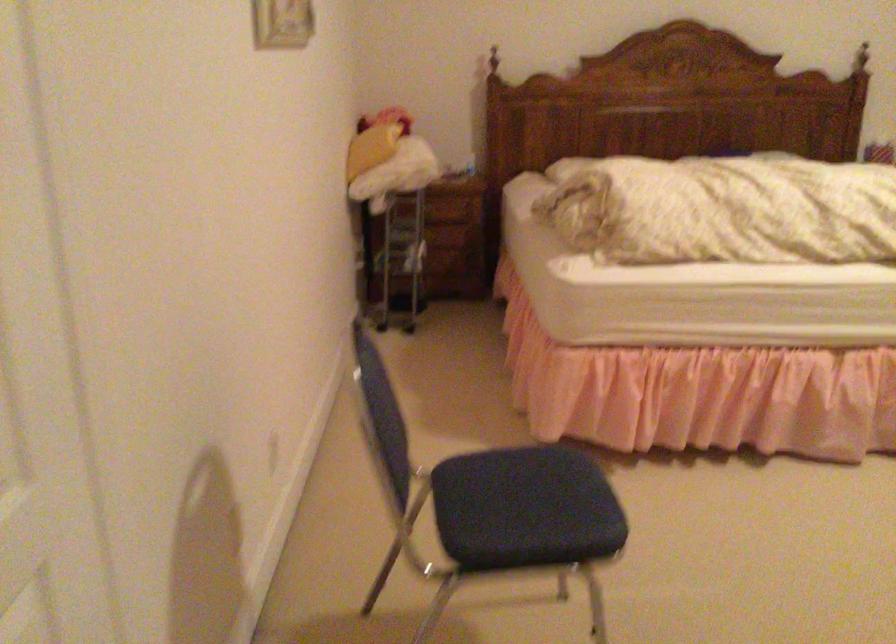
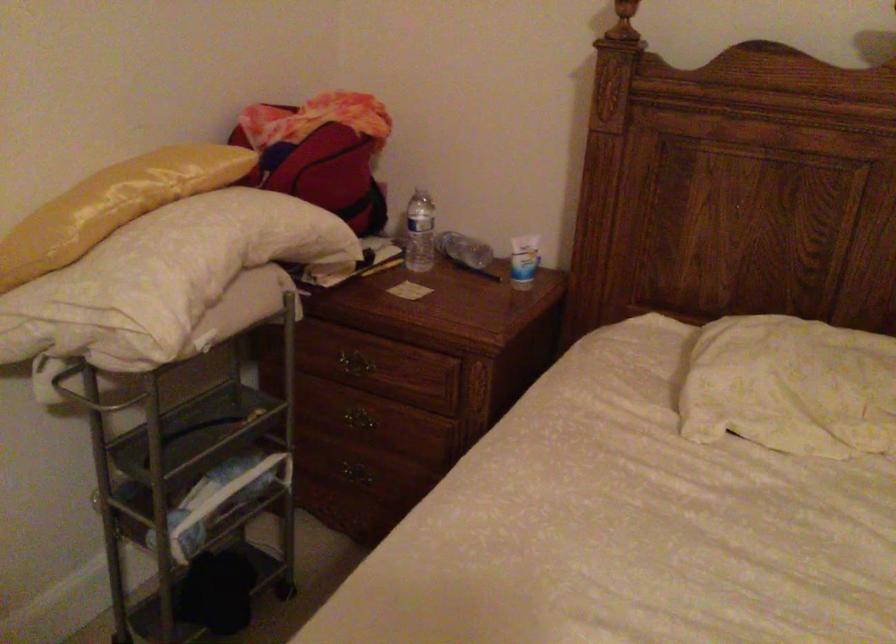
In the second image, find the point that corresponds to (x=418, y=205) in the first image.

(350, 365)